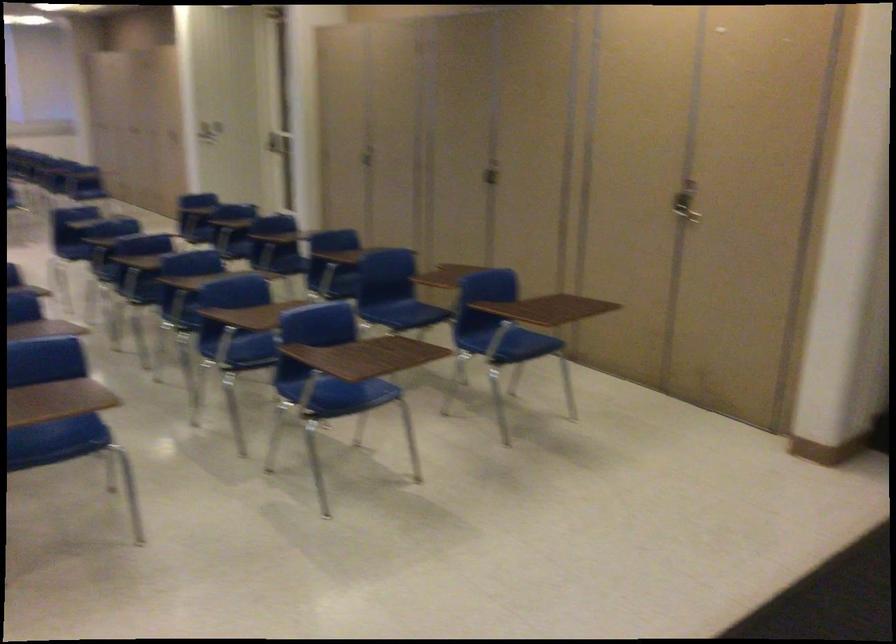
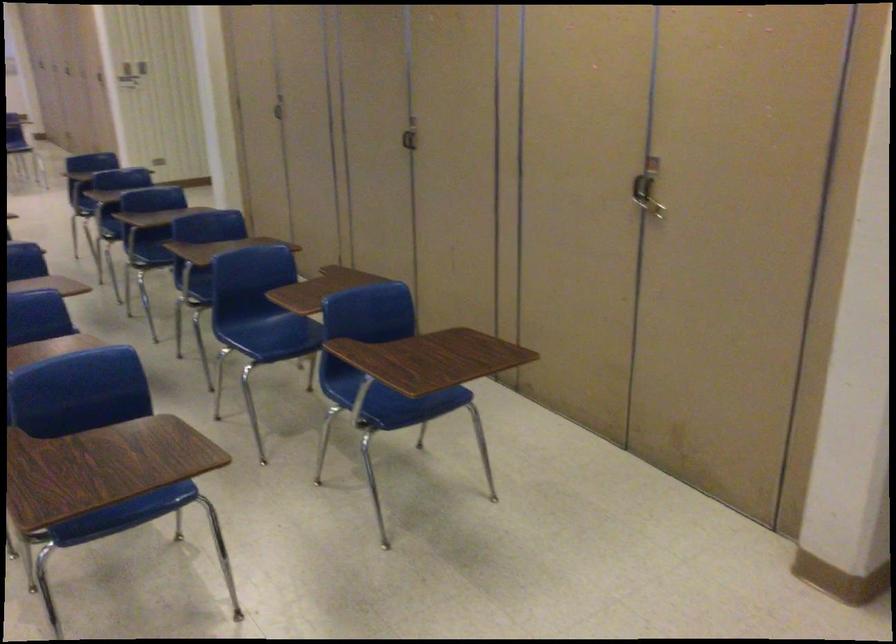
Locate, in the second image, the point that corresponds to the point at 357,400 in the first image.

(126, 516)